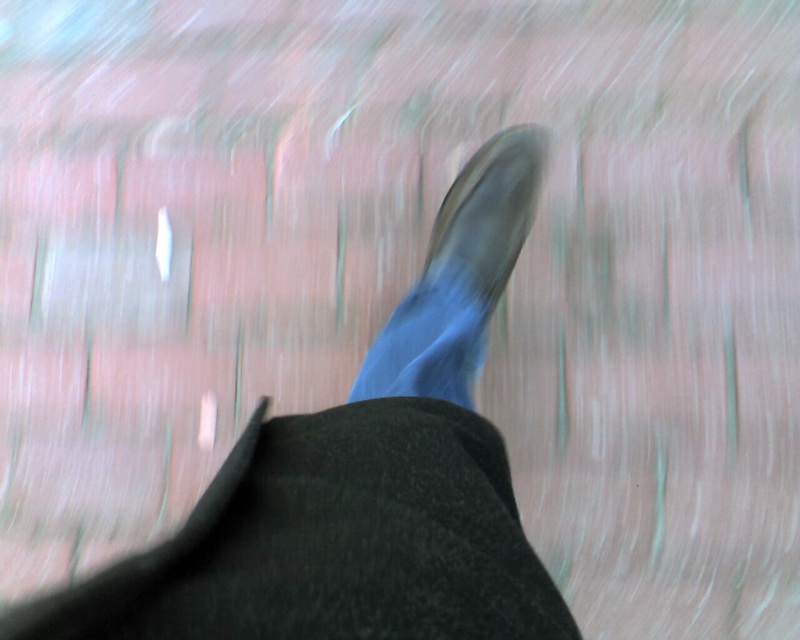
Question: Does shiny black shoe at center appear on the right side of leather shoe at center?

Choices:
 (A) yes
 (B) no

Answer: (B)

Question: Which of the following is the farthest from the observer?

Choices:
 (A) (352, 580)
 (B) (462, 288)

Answer: (B)

Question: Among these points, which one is nearest to the camera?

Choices:
 (A) (36, 625)
 (B) (460, 188)

Answer: (A)

Question: Considering the relative positions of shiny black shoe at center and leather shoe at center in the image provided, where is shiny black shoe at center located with respect to leather shoe at center?

Choices:
 (A) above
 (B) below

Answer: (B)

Question: Does shiny black shoe at center lie behind leather shoe at center?

Choices:
 (A) no
 (B) yes

Answer: (A)